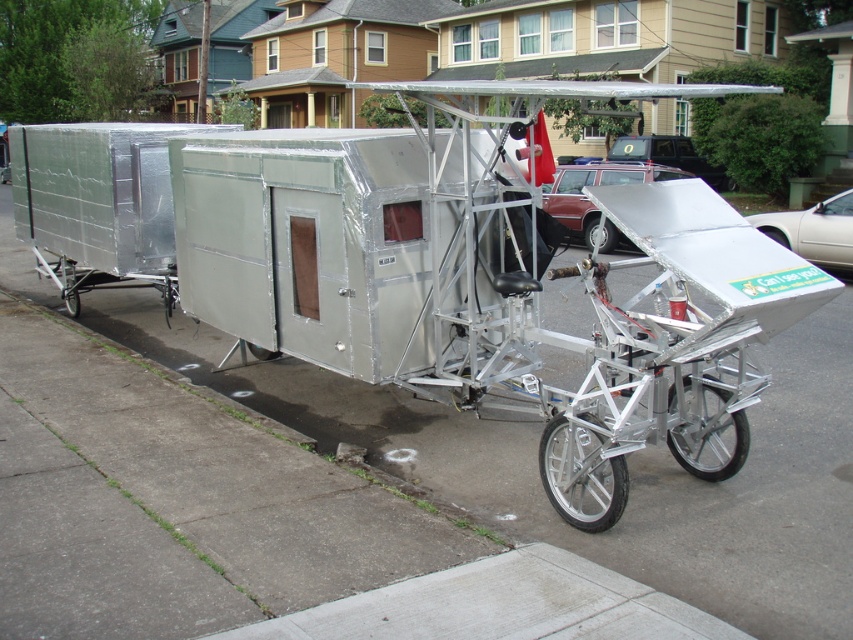
Can you confirm if silver metallic wheel at lower center is thinner than black rubber wheel at lower right?

No.

Is silver metallic wheel at lower center positioned in front of black rubber wheel at lower right?

Yes.

Which is behind, point (581, 413) or point (775, 228)?

Point (775, 228)

Where is `silver metallic wheel at lower center`? The image size is (853, 640). silver metallic wheel at lower center is located at coordinates (581, 476).

Can you confirm if silver metallic wheel at lower right is positioned to the right of silver metallic wheel at center?

No, silver metallic wheel at lower right is not to the right of silver metallic wheel at center.

Is point (693, 397) farther from camera compared to point (605, 240)?

No, it is in front of (605, 240).

Find the location of a particular element. silver metallic wheel at lower right is located at coordinates (709, 435).

Is silver metallic wheel at lower right to the left of black rubber wheel at lower right from the viewer's perspective?

Yes, silver metallic wheel at lower right is to the left of black rubber wheel at lower right.

Who is more forward, (741, 424) or (780, 243)?

Point (741, 424) is more forward.

Does point (669, 429) come closer to viewer compared to point (776, 228)?

Yes.

What are the coordinates of `silver metallic wheel at lower right` in the screenshot? It's located at (709, 435).